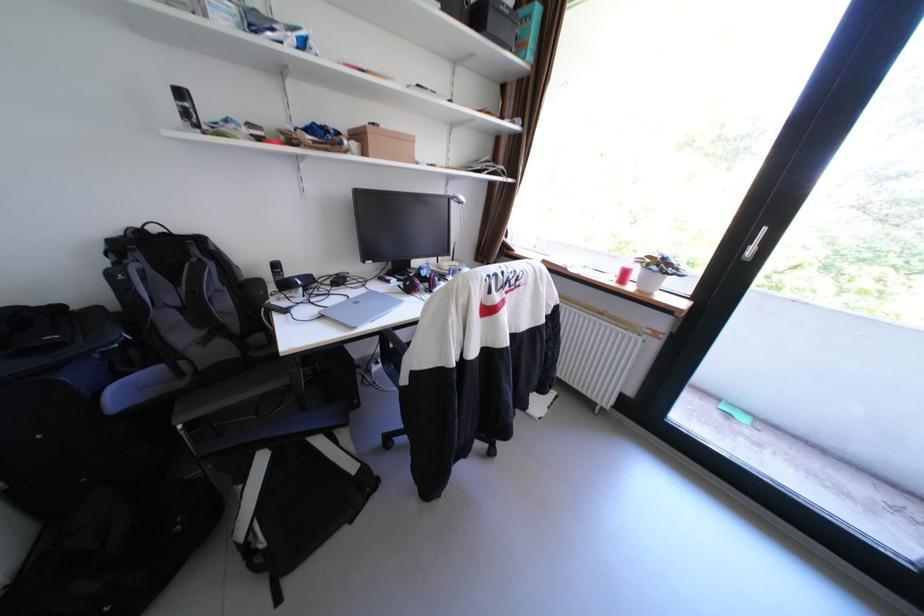
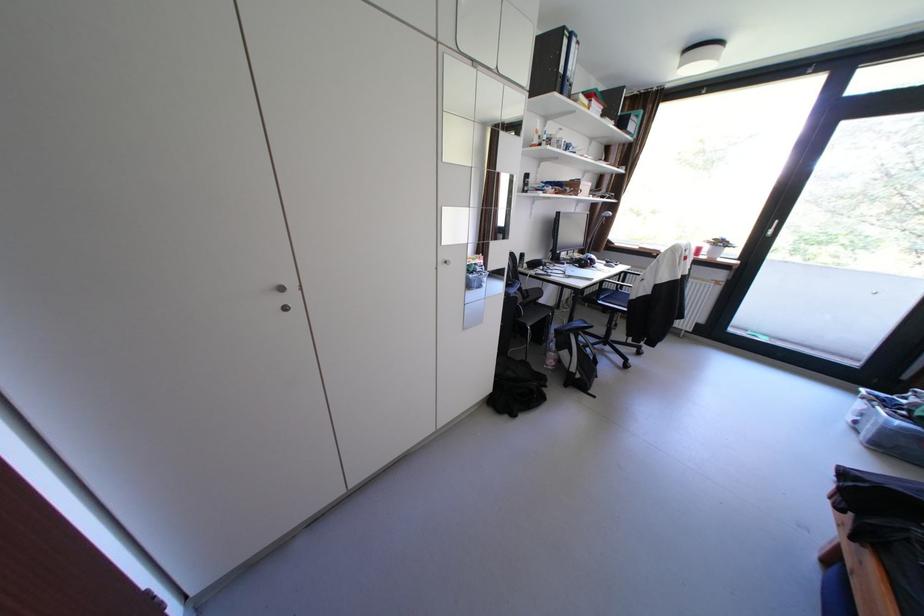
Find the pixel in the second image that matches point 251,487 in the first image.

(578, 351)